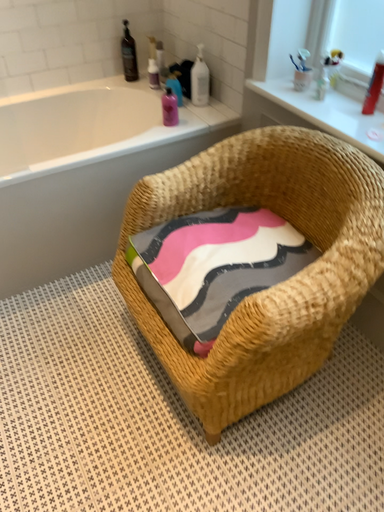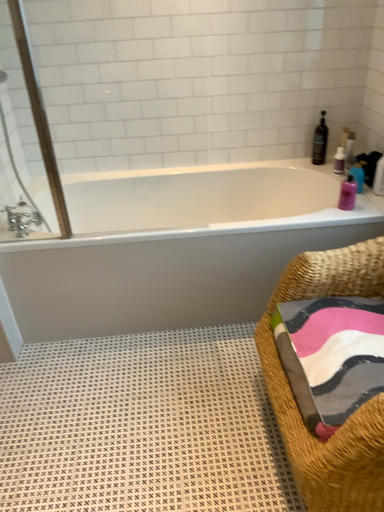
Question: How did the camera likely rotate when shooting the video?

Choices:
 (A) rotated right
 (B) rotated left

Answer: (B)